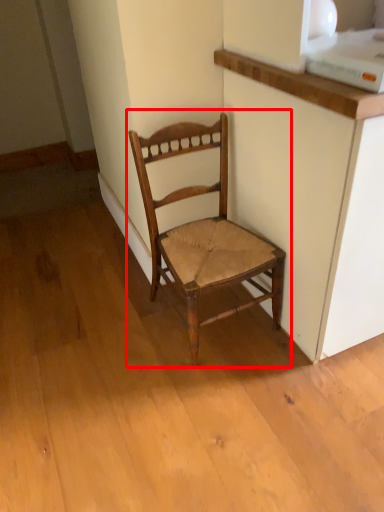
Question: Considering the relative positions of chair (annotated by the red box) and cabinetry in the image provided, where is chair (annotated by the red box) located with respect to the staircase?

Choices:
 (A) left
 (B) right

Answer: (A)